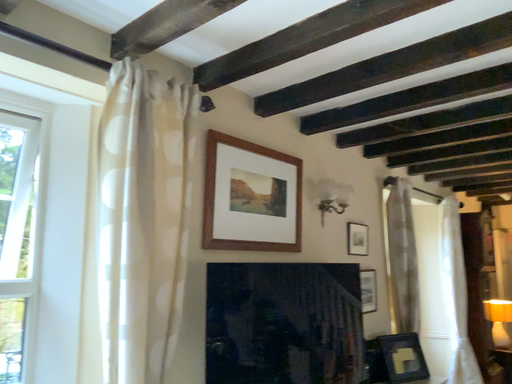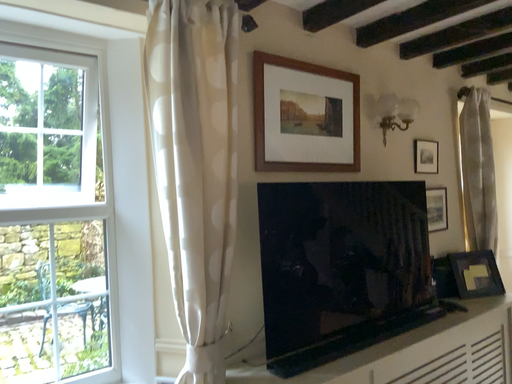
Question: How did the camera likely rotate when shooting the video?

Choices:
 (A) rotated upward
 (B) rotated downward

Answer: (B)